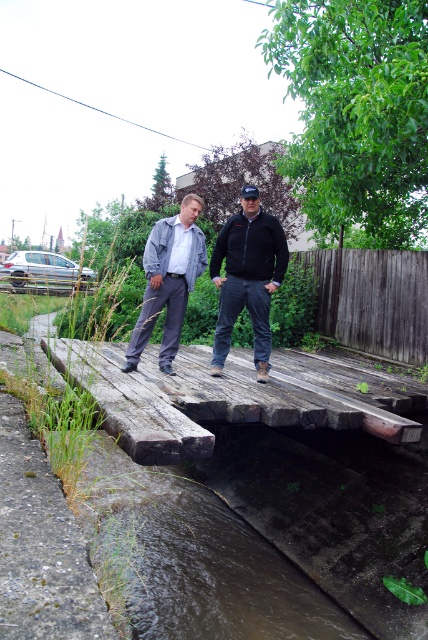
Question: Among these points, which one is farthest from the camera?

Choices:
 (A) (267, 244)
 (B) (214, 556)

Answer: (B)

Question: Is weathered wood bridge at center wider than brown concrete stream at lower center?

Choices:
 (A) yes
 (B) no

Answer: (A)

Question: Is brown concrete stream at lower center smaller than black fleece jacket at center?

Choices:
 (A) yes
 (B) no

Answer: (B)

Question: From the image, what is the correct spatial relationship of weathered wood bridge at center in relation to matte gray jacket at center?

Choices:
 (A) right
 (B) left

Answer: (A)

Question: Which object appears farthest from the camera in this image?

Choices:
 (A) matte gray jacket at center
 (B) weathered wood bridge at center
 (C) matte black jacket at center

Answer: (C)

Question: Among these objects, which one is farthest from the camera?

Choices:
 (A) black fleece jacket at center
 (B) brown concrete stream at lower center
 (C) matte black jacket at center
 (D) matte gray jacket at center

Answer: (A)